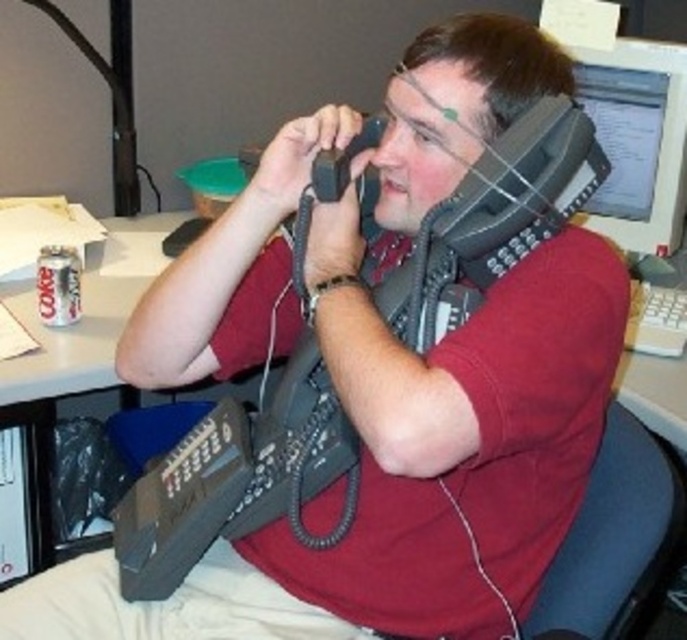
Question: Among these objects, which one is farthest from the camera?

Choices:
 (A) black rubber earphone at upper center
 (B) matte plastic monitor at upper right

Answer: (B)

Question: Does matte plastic monitor at upper right appear under black rubber earphone at upper center?

Choices:
 (A) yes
 (B) no

Answer: (B)

Question: Can you confirm if matte plastic monitor at upper right is bigger than black rubber earphone at upper center?

Choices:
 (A) yes
 (B) no

Answer: (A)

Question: Observing the image, what is the correct spatial positioning of matte plastic monitor at upper right in reference to black rubber earphone at upper center?

Choices:
 (A) left
 (B) right

Answer: (B)